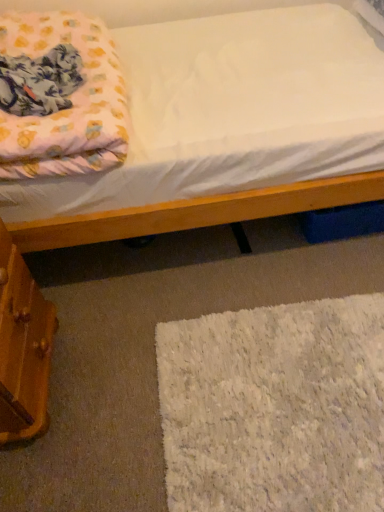
This screenshot has height=512, width=384. Find the location of `spots to the right of wooden drawer at lower left`. spots to the right of wooden drawer at lower left is located at coordinates (105, 365).